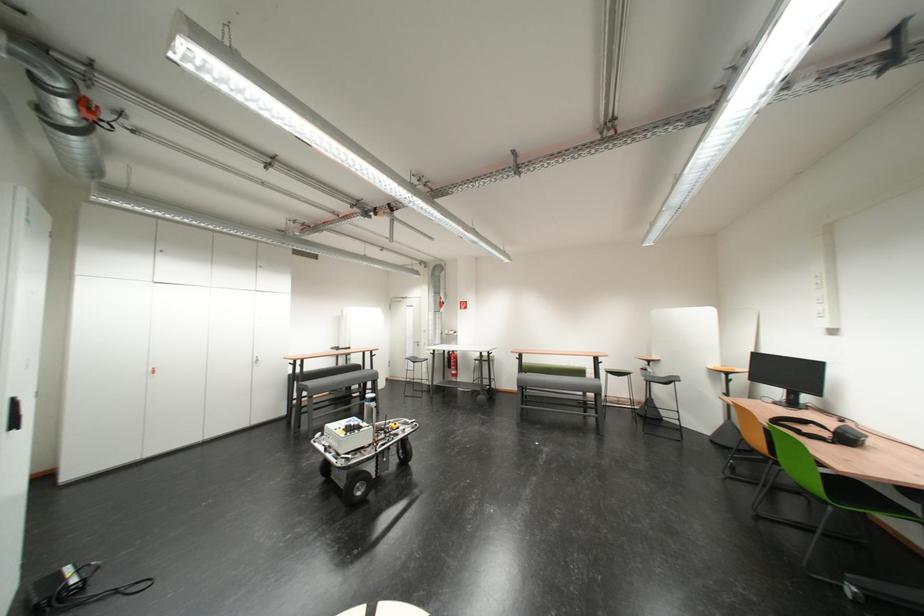
What do you see at coordinates (14, 422) in the screenshot? I see `the black door handle` at bounding box center [14, 422].